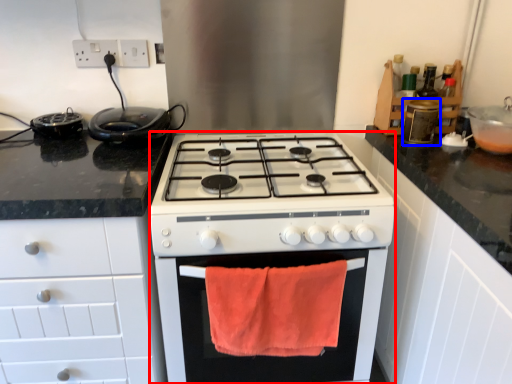
Question: Which point is further to the camera, appliance (highlighted by a red box) or appliance (highlighted by a blue box)?

Choices:
 (A) appliance
 (B) appliance

Answer: (B)